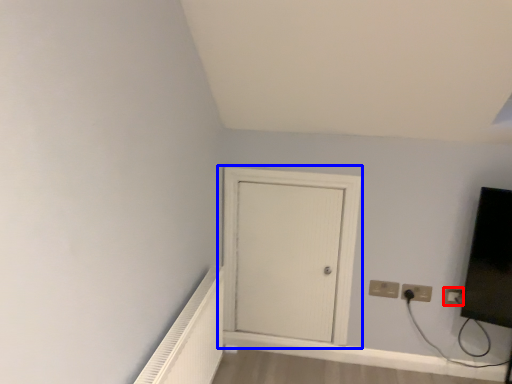
Question: Which object appears farthest to the camera in this image, electric outlet (highlighted by a red box) or door (highlighted by a blue box)?

Choices:
 (A) electric outlet
 (B) door

Answer: (A)